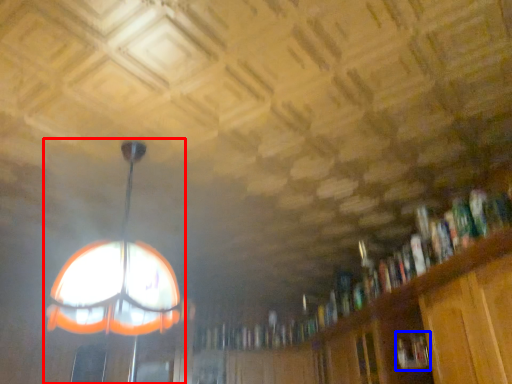
Question: Which object is closer to the camera taking this photo, lamp (highlighted by a red box) or book (highlighted by a blue box)?

Choices:
 (A) lamp
 (B) book

Answer: (A)